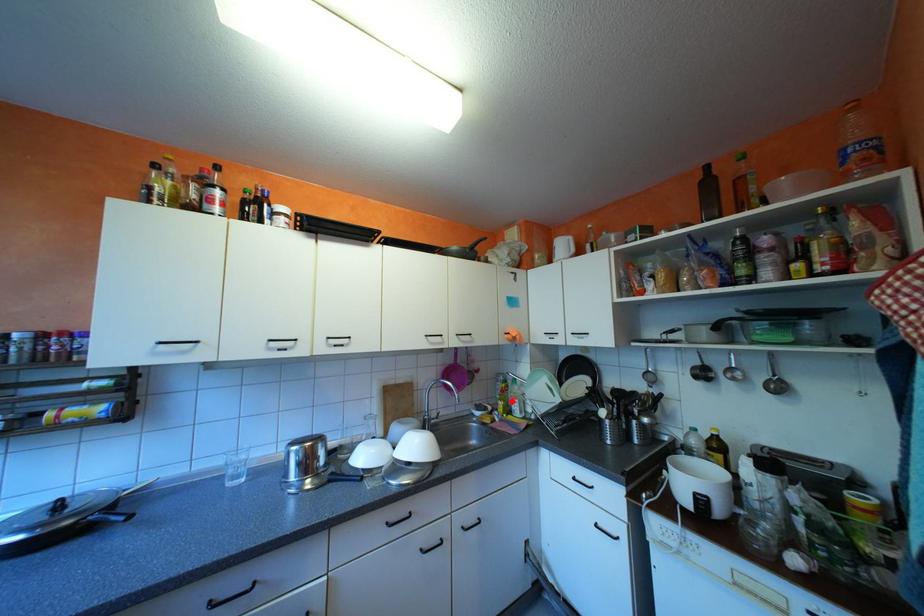
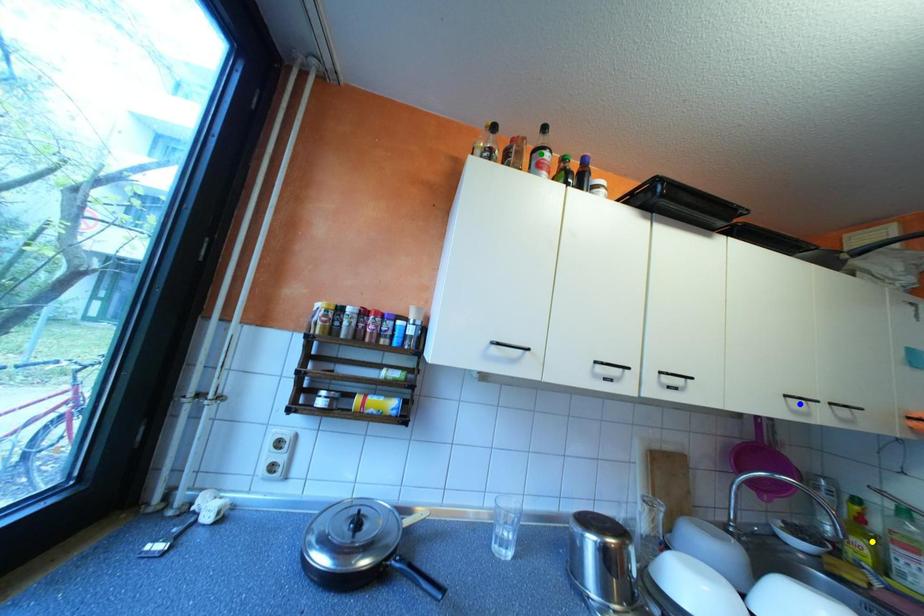
Question: I am providing you with two images of the same scene from different viewpoints. A red point is marked on the first image. You are given multiple points on the second image. Which point in image 2 represents the same 3d spot as the red point in image 1?

Choices:
 (A) yellow point
 (B) green point
 (C) blue point

Answer: (A)